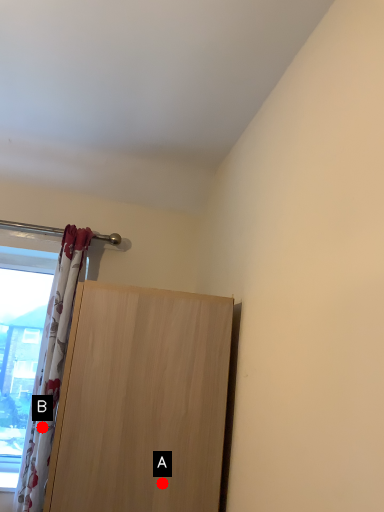
Question: Two points are circled on the image, labeled by A and B beside each circle. Which point is closer to the camera taking this photo?

Choices:
 (A) A is closer
 (B) B is closer

Answer: (A)